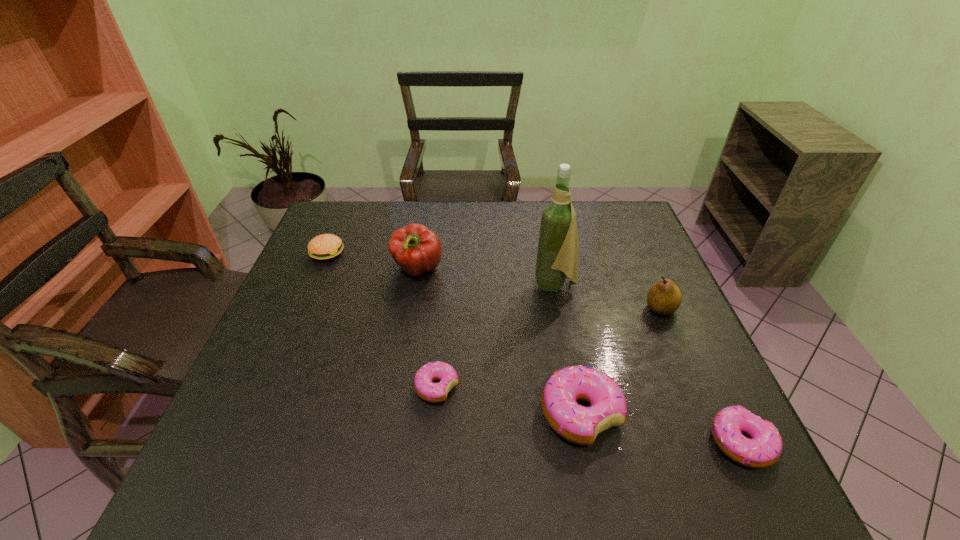
Identify which object is the closest to the pear. Please provide its 2D coordinates. Your answer should be formatted as a tuple, i.e. [(x, y)], where the tuple contains the x and y coordinates of a point satisfying the conditions above.

[(557, 252)]

Locate an element on the screen. The height and width of the screenshot is (540, 960). the fifth closest object to the bell pepper is located at coordinates [664, 297].

Locate an element on the screen. This screenshot has width=960, height=540. doughnut object that ranks as the closest to the wine bottle is located at coordinates (577, 424).

Find the location of a particular element. The height and width of the screenshot is (540, 960). the closest doughnut to the second doughnut from right to left is located at coordinates (764, 448).

Image resolution: width=960 pixels, height=540 pixels. Identify the location of vacant point that satisfies the following two spatial constraints: 1. on the back side of the second doughnut from left to right; 2. on the front-facing side of the tallest object. pos(556,285).

This screenshot has width=960, height=540. Identify the location of blank area in the image that satisfies the following two spatial constraints: 1. on the front side of the shortest object; 2. on the left side of the second doughnut from left to right. (435, 414).

This screenshot has width=960, height=540. Find the location of `free space that satisfies the following two spatial constraints: 1. on the front-facing side of the wine bottle; 2. on the back side of the second tallest doughnut`. free space that satisfies the following two spatial constraints: 1. on the front-facing side of the wine bottle; 2. on the back side of the second tallest doughnut is located at coordinates (585, 442).

Where is `vacant space that satisfies the following two spatial constraints: 1. on the front-facing side of the tallest object; 2. on the back side of the second tallest doughnut`? The height and width of the screenshot is (540, 960). vacant space that satisfies the following two spatial constraints: 1. on the front-facing side of the tallest object; 2. on the back side of the second tallest doughnut is located at coordinates (585, 442).

Identify the location of free space that satisfies the following two spatial constraints: 1. on the front-facing side of the wine bottle; 2. on the back side of the rightmost doughnut. The image size is (960, 540). (585, 442).

Find the location of a particular element. This screenshot has width=960, height=540. vacant space that satisfies the following two spatial constraints: 1. on the front-facing side of the second doughnut from right to left; 2. on the right side of the wine bottle is located at coordinates (579, 414).